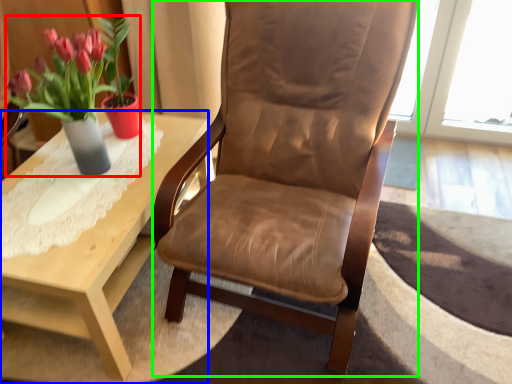
Question: Considering the real-world distances, which object is farthest from houseplant (highlighted by a red box)? coffee table (highlighted by a blue box) or chair (highlighted by a green box)?

Choices:
 (A) coffee table
 (B) chair

Answer: (B)